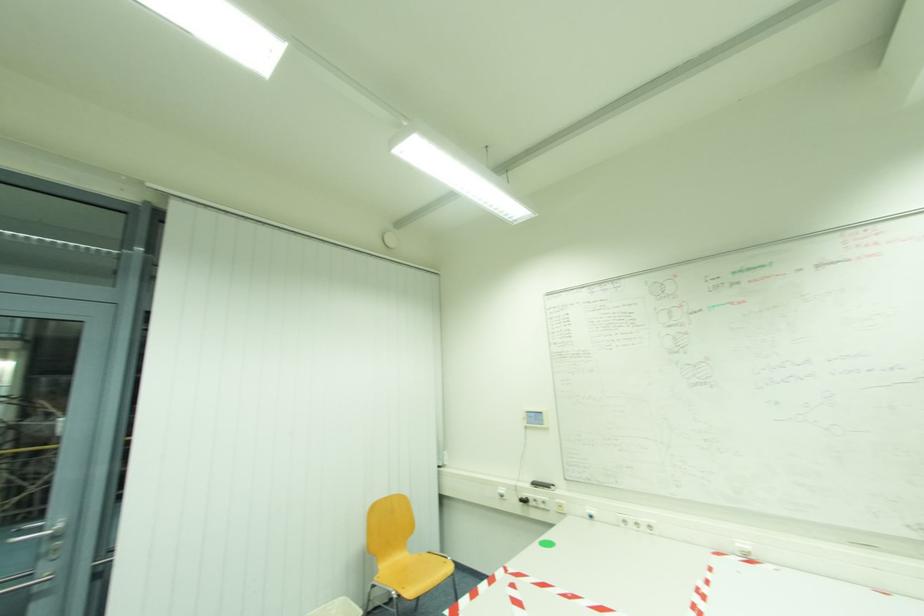
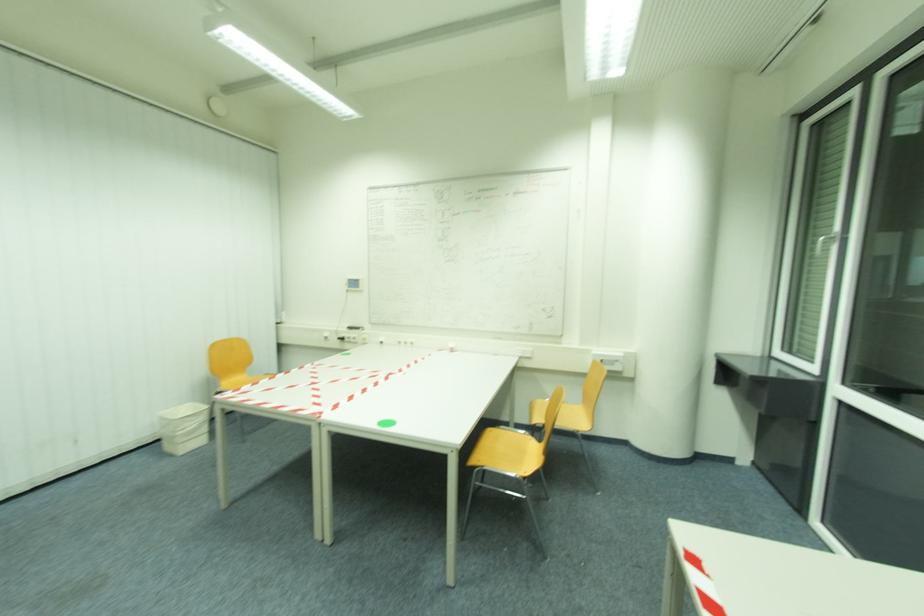
Question: In a continuous first-person perspective shot, in which direction is the camera moving?

Choices:
 (A) Left
 (B) Right
 (C) Forward
 (D) Backward

Answer: (D)